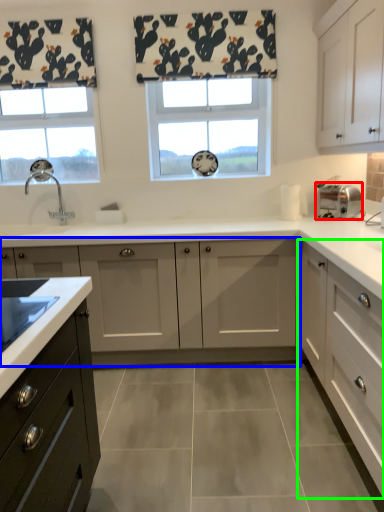
Question: Which object is the farthest from toaster (highlighted by a red box)? Choose among these: cabinetry (highlighted by a blue box) or cabinetry (highlighted by a green box).

Choices:
 (A) cabinetry
 (B) cabinetry

Answer: (A)